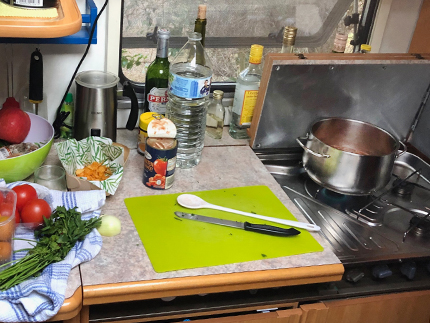
Identify the location of stove. (390, 216).